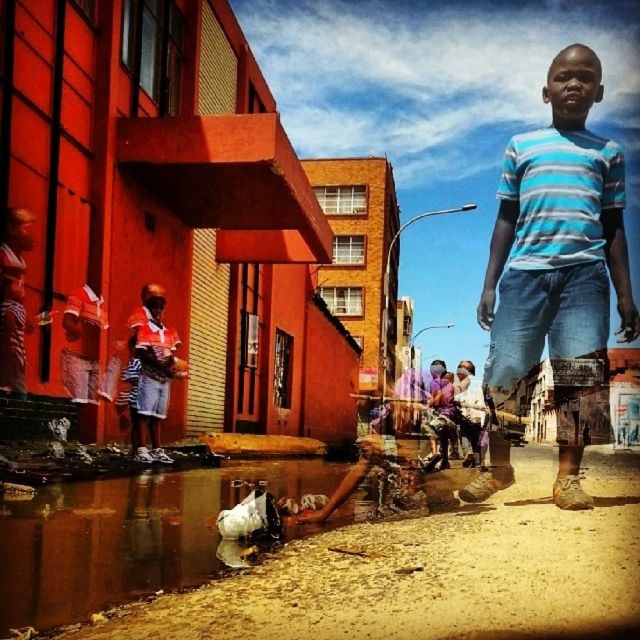
Question: Which of the following is the farthest from the observer?

Choices:
 (A) blue striped shirt at center
 (B) brown plastic bag at lower center
 (C) matte red shorts at lower left

Answer: (C)

Question: Where is blue striped shirt at center located in relation to matte red shorts at lower left in the image?

Choices:
 (A) left
 (B) right

Answer: (B)

Question: Which of the following is the farthest from the observer?

Choices:
 (A) brown plastic bag at lower center
 (B) matte red shorts at lower left
 (C) blue striped shirt at center

Answer: (B)

Question: Can you confirm if blue striped shirt at center is bigger than brown plastic bag at lower center?

Choices:
 (A) yes
 (B) no

Answer: (A)

Question: From the image, what is the correct spatial relationship of blue striped shirt at center in relation to matte red shorts at lower left?

Choices:
 (A) above
 (B) below

Answer: (A)

Question: Estimate the real-world distances between objects in this image. Which object is closer to the brown plastic bag at lower center?

Choices:
 (A) blue striped shirt at center
 (B) matte red shorts at lower left

Answer: (A)